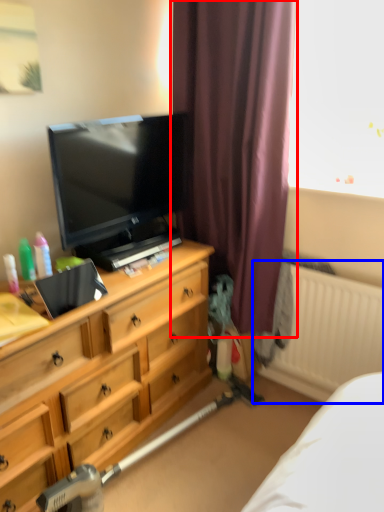
Question: Among these objects, which one is nearest to the camera, curtain (highlighted by a red box) or radiator (highlighted by a blue box)?

Choices:
 (A) curtain
 (B) radiator

Answer: (A)